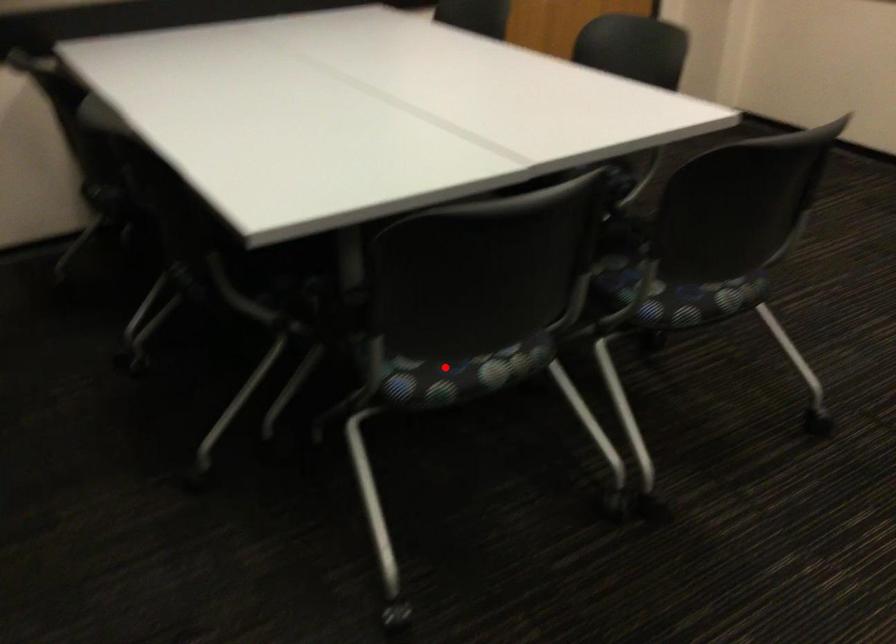
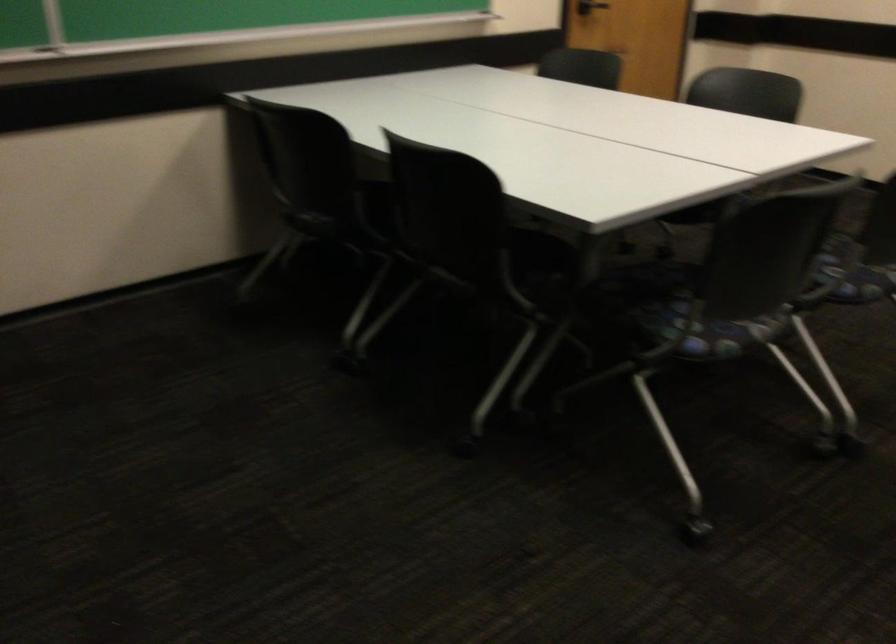
Find the pixel in the second image that matches the highlighted location in the first image.

(719, 333)